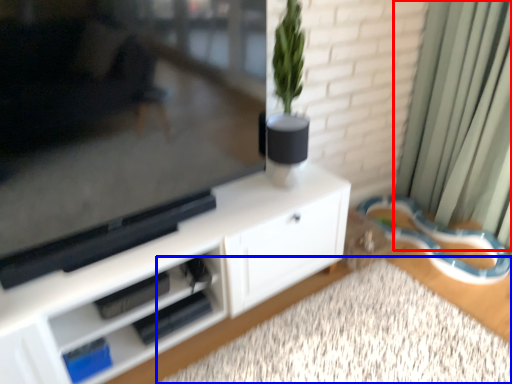
Question: Which of the following is the closest to the observer, curtain (highlighted by a red box) or plain (highlighted by a blue box)?

Choices:
 (A) curtain
 (B) plain

Answer: (B)